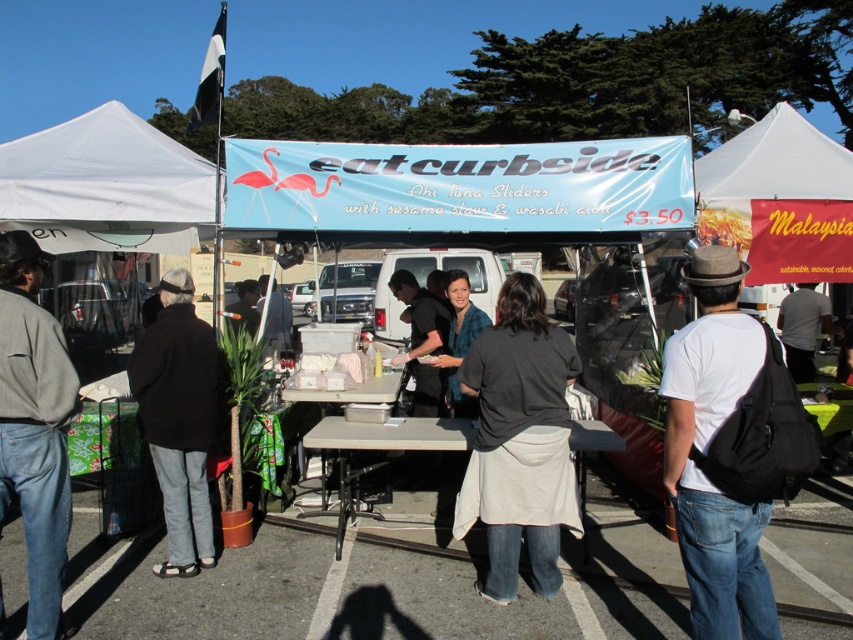
You are standing at the entrance of the food market and want to approach the stall marked by the eatcurbside sign. If you walk straight ahead, how far will you have to walk to reach the point marked at coordinates point (x=465, y=353)?

The point (x=465, y=353) is 5.01 meters away from the viewer, so you will have to walk 5.01 meters straight ahead to reach it.

You are a customer at the eatcurbside food stall. You see a white plastic table at center and a white shirt at center. Which object is located to the left of the other?

The white plastic table at center is to the left of the white shirt at center.

You are a customer at the eatcurbside food stall. You want to place your order and sit at the white plastic table at center. What is the shortest path to reach the table from the stall counter?

The white plastic table at center is located at point (386, 438), so the shortest path would be to walk directly towards that coordinate from the stall counter.